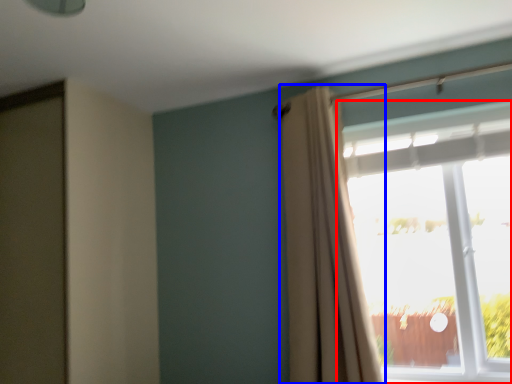
Question: Which point is closer to the camera, window (highlighted by a red box) or curtain (highlighted by a blue box)?

Choices:
 (A) window
 (B) curtain

Answer: (B)